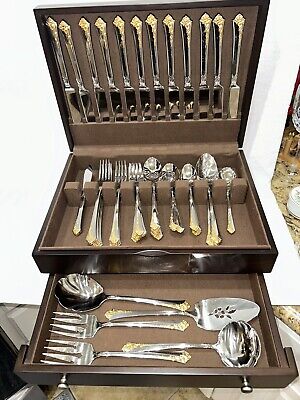
The height and width of the screenshot is (400, 300). In order to click on spoons in this screenshot , I will do `click(82, 296)`, `click(250, 309)`, `click(241, 335)`, `click(208, 169)`, `click(226, 176)`, `click(190, 170)`, `click(172, 174)`, `click(154, 168)`.